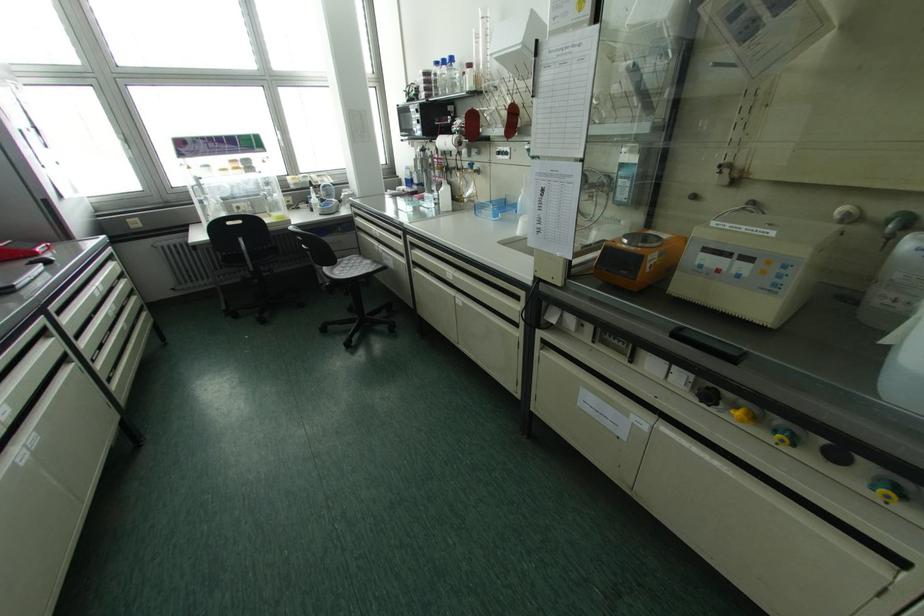
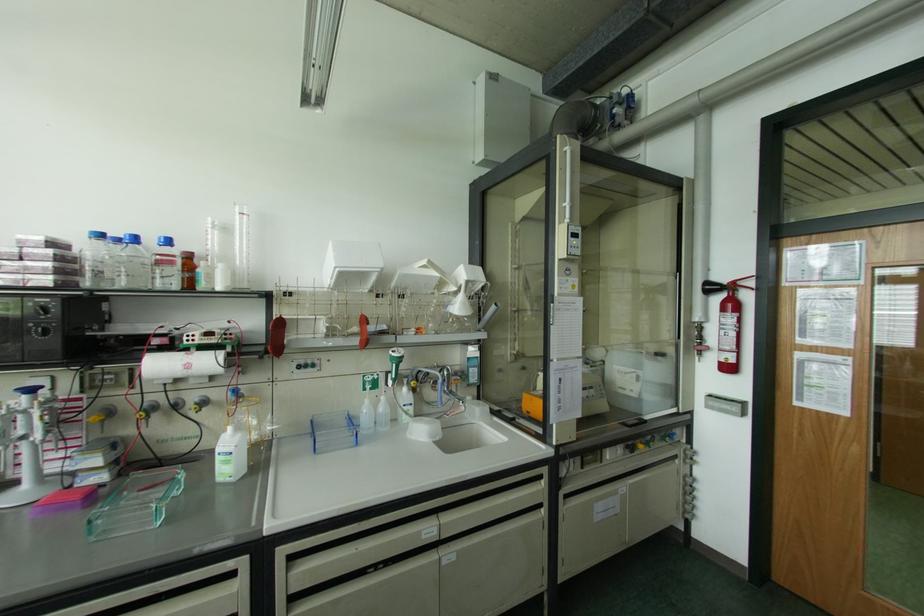
The point at [451,59] is marked in the first image. Where is the corresponding point in the second image?

(167, 241)